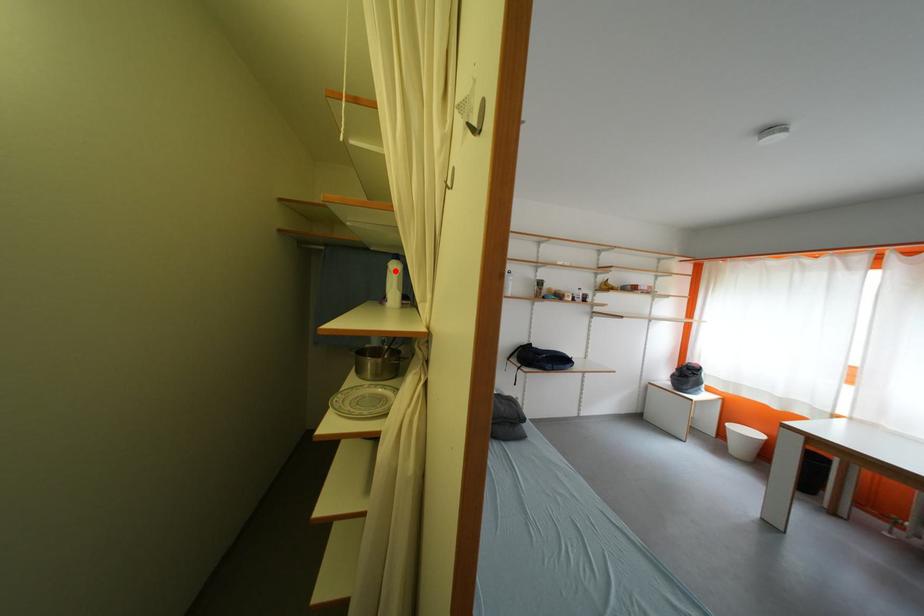
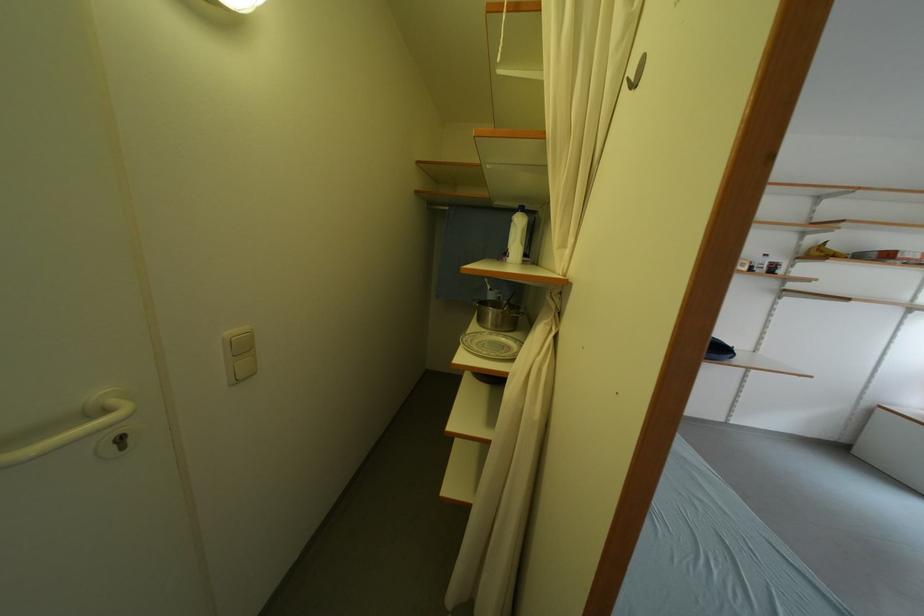
Where in the second image is the point corresponding to the highlighted location from the first image?

(518, 225)